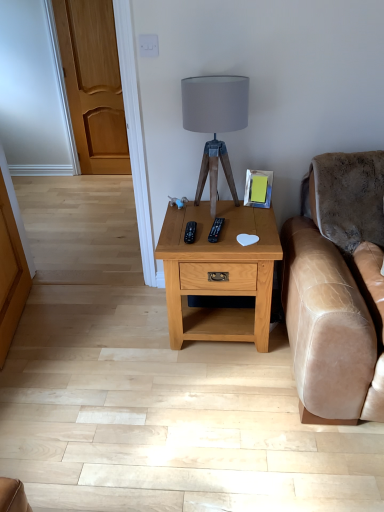
Question: Is black plastic remote at center, the 1th remote in the right-to-left sequence, in front of or behind black plastic remote at center, acting as the first remote starting from the left, in the image?

Choices:
 (A) behind
 (B) front

Answer: (B)

Question: Is black plastic remote at center, the 1th remote in the right-to-left sequence, inside the boundaries of black plastic remote at center, acting as the first remote starting from the left, or outside?

Choices:
 (A) inside
 (B) outside

Answer: (B)

Question: Which is nearer to the black plastic remote at center, acting as the first remote starting from the left?

Choices:
 (A) black plastic remote at center, the 2th remote from the left
 (B) matte gray fabric lampshade at center
 (C) light brown wood nightstand at center

Answer: (A)

Question: Estimate the real-world distances between objects in this image. Which object is closer to the light brown wood nightstand at center?

Choices:
 (A) black plastic remote at center, the 2th remote from the left
 (B) matte gray fabric lampshade at center
 (C) black plastic remote at center, acting as the first remote starting from the left

Answer: (A)